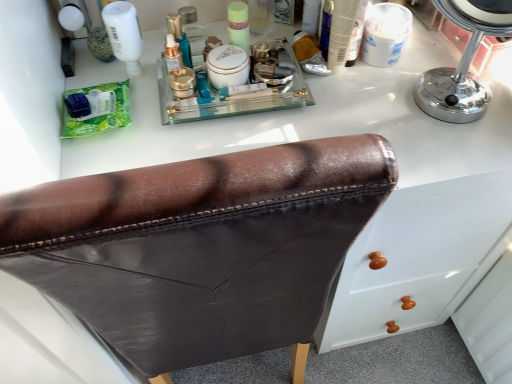
The image size is (512, 384). I want to click on green matte packet at left, so click(96, 109).

What do you see at coordinates (200, 246) in the screenshot? The image size is (512, 384). I see `brown leather chair at center` at bounding box center [200, 246].

The image size is (512, 384). Find the location of `matte green jar at center`. matte green jar at center is located at coordinates (238, 25).

In the image, is brown leather chair at center on the left side or the right side of chrome/metallic mirror at upper right?

Clearly, brown leather chair at center is on the left of chrome/metallic mirror at upper right in the image.

Who is taller, brown leather chair at center or chrome/metallic mirror at upper right?

With more height is brown leather chair at center.

Which point is more forward, (184,171) or (508,5)?

→ The point (184,171) is in front.

In order to click on furniture on the left of chrome/metallic mirror at upper right in this screenshot , I will do `click(200, 246)`.

Between brown leather chair at center and matte green jar at center, which one has smaller width?

matte green jar at center is thinner.

Can matte green jar at center be found inside brown leather chair at center?

No, matte green jar at center is not a part of brown leather chair at center.

Is brown leather chair at center facing towards matte green jar at center?

Yes, brown leather chair at center faces towards matte green jar at center.

How distant is brown leather chair at center from matte green jar at center?

20.13 inches.

In terms of width, does green matte packet at left look wider or thinner when compared to chrome/metallic mirror at upper right?

Clearly, green matte packet at left has less width compared to chrome/metallic mirror at upper right.

Is green matte packet at left facing towards chrome/metallic mirror at upper right?

No, green matte packet at left does not turn towards chrome/metallic mirror at upper right.

Looking at this image, from the image's perspective, is green matte packet at left located above chrome/metallic mirror at upper right?

No.

Does green matte packet at left come behind chrome/metallic mirror at upper right?

Yes, it is.

Is green matte packet at left next to matte green jar at center?

No, green matte packet at left is not making contact with matte green jar at center.

Who is more distant, green matte packet at left or matte green jar at center?

matte green jar at center is more distant.

The image size is (512, 384). Find the location of `toiletry above the green matte packet at left (from the image's perspective)`. toiletry above the green matte packet at left (from the image's perspective) is located at coordinates (238, 25).

Based on the photo, could you tell me if green matte packet at left is facing matte green jar at center?

Yes, green matte packet at left is turned towards matte green jar at center.

Does chrome/metallic mirror at upper right have a smaller size compared to matte green jar at center?

Actually, chrome/metallic mirror at upper right might be larger than matte green jar at center.

From the image's perspective, who appears lower, chrome/metallic mirror at upper right or matte green jar at center?

chrome/metallic mirror at upper right appears lower in the image.

Does chrome/metallic mirror at upper right have a lesser width compared to matte green jar at center?

No, chrome/metallic mirror at upper right is not thinner than matte green jar at center.

Can you tell me how much chrome/metallic mirror at upper right and matte green jar at center differ in facing direction?

38.5 degrees.

Which object is more forward, brown leather chair at center or green matte packet at left?

brown leather chair at center.

In terms of size, does brown leather chair at center appear bigger or smaller than green matte packet at left?

brown leather chair at center is bigger than green matte packet at left.

Is point (307, 230) closer to viewer compared to point (81, 98)?

Yes.

You are a GUI agent. You are given a task and a screenshot of the screen. Output one action in this format:
    pyautogui.click(x=<x>, y=<y>)
    Task: Click on the product on the left of brown leather chair at center
    The image size is (512, 384).
    Given the screenshot: What is the action you would take?
    pyautogui.click(x=96, y=109)

How many degrees apart are the facing directions of matte green jar at center and chrome/metallic mirror at upper right?

The facing directions of matte green jar at center and chrome/metallic mirror at upper right are 38.5 degrees apart.

Is matte green jar at center in contact with chrome/metallic mirror at upper right?

No, matte green jar at center is not beside chrome/metallic mirror at upper right.

From the picture: From the image's perspective, would you say matte green jar at center is positioned over chrome/metallic mirror at upper right?

Yes, from the image's perspective, matte green jar at center is over chrome/metallic mirror at upper right.

From their relative heights in the image, would you say matte green jar at center is taller or shorter than chrome/metallic mirror at upper right?

In the image, matte green jar at center appears to be shorter than chrome/metallic mirror at upper right.

Identify the location of mirror above the brown leather chair at center (from a real-world perspective). The image size is (512, 384). (463, 62).

This screenshot has width=512, height=384. I want to click on furniture on the left of matte green jar at center, so pos(200,246).

Which object lies nearer to the anchor point matte green jar at center, green matte packet at left or chrome/metallic mirror at upper right?

green matte packet at left is positioned closer to the anchor matte green jar at center.

Which object lies nearer to the anchor point matte green jar at center, green matte packet at left or brown leather chair at center?

The object closer to matte green jar at center is green matte packet at left.

Based on their spatial positions, is chrome/metallic mirror at upper right or matte green jar at center further from green matte packet at left?

Based on the image, chrome/metallic mirror at upper right appears to be further to green matte packet at left.

From the image, which object appears to be nearer to matte green jar at center, chrome/metallic mirror at upper right or green matte packet at left?

The object closer to matte green jar at center is green matte packet at left.

In the scene shown: Estimate the real-world distances between objects in this image. Which object is closer to chrome/metallic mirror at upper right, green matte packet at left or matte green jar at center?

matte green jar at center is closer to chrome/metallic mirror at upper right.

Which object lies nearer to the anchor point brown leather chair at center, green matte packet at left or matte green jar at center?

Based on the image, green matte packet at left appears to be nearer to brown leather chair at center.

From the image, which object appears to be nearer to chrome/metallic mirror at upper right, green matte packet at left or brown leather chair at center?

brown leather chair at center is positioned closer to the anchor chrome/metallic mirror at upper right.

Considering their positions, is matte green jar at center positioned closer to brown leather chair at center than chrome/metallic mirror at upper right?

The object closer to brown leather chair at center is chrome/metallic mirror at upper right.

The height and width of the screenshot is (384, 512). What are the coordinates of `toiletry situated between green matte packet at left and chrome/metallic mirror at upper right from left to right` in the screenshot? It's located at pos(238,25).

Locate an element on the screen. The width and height of the screenshot is (512, 384). product between brown leather chair at center and matte green jar at center from front to back is located at coordinates (96, 109).

Find the location of a particular element. Image resolution: width=512 pixels, height=384 pixels. mirror between matte green jar at center and brown leather chair at center in the up-down direction is located at coordinates (463, 62).

This screenshot has height=384, width=512. I want to click on furniture situated between green matte packet at left and chrome/metallic mirror at upper right from left to right, so click(x=200, y=246).